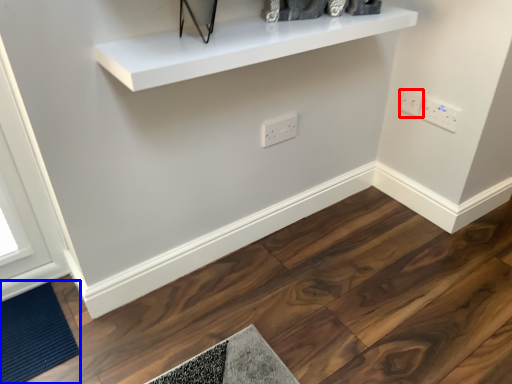
Question: Which object appears closest to the camera in this image, electric outlet (highlighted by a red box) or doormat (highlighted by a blue box)?

Choices:
 (A) electric outlet
 (B) doormat

Answer: (B)